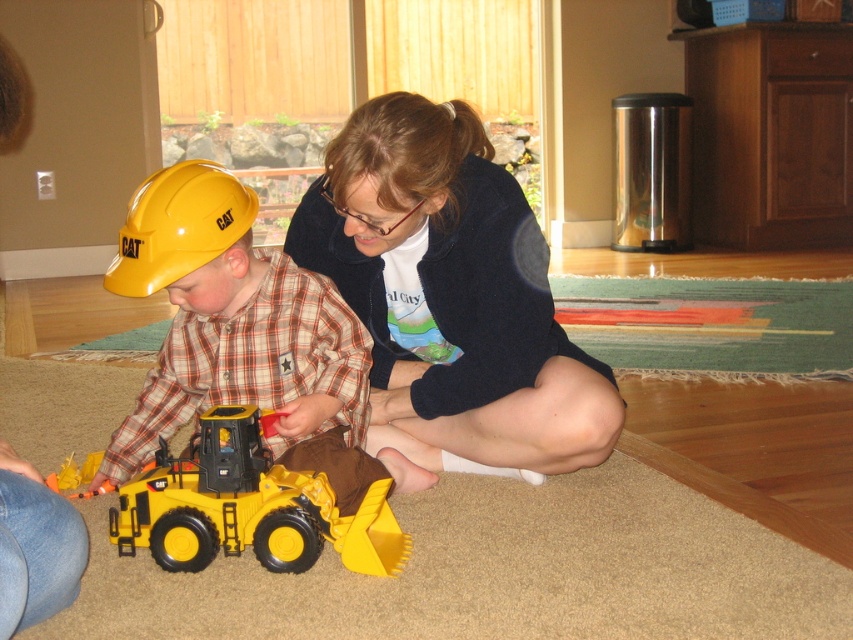
You are standing at the point labeled as point (373, 560) and want to reach the door located at the opposite side of the room. There is a large toy bulldozer blocking your path. Can you walk around it without stepping on the colorful rug?

The distance between you and the door is 5.39 feet. Since the toy bulldozer is blocking the path, you can walk around it by staying on the wooden flooring, avoiding the colorful rug, to reach the door safely.

You are a photographer setting up a shoot in the living room. You need to position a light source to the left of the yellow hard hat at left. Will the light be to the left or right of the matte blue sweater at center?

The matte blue sweater at center is to the right of the yellow hard hat at left, so placing the light to the left of the yellow hard hat at left would position it to the left of the matte blue sweater at center as well.